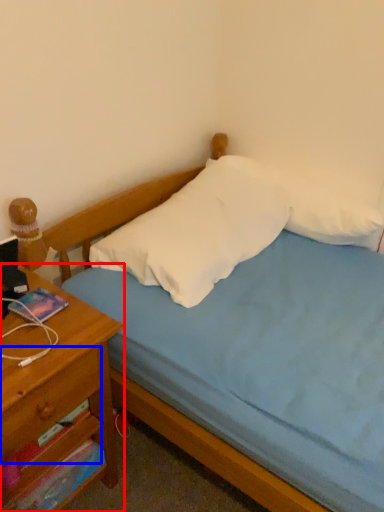
Question: Which object is closer to the camera taking this photo, nightstand (highlighted by a red box) or drawer (highlighted by a blue box)?

Choices:
 (A) nightstand
 (B) drawer

Answer: (A)